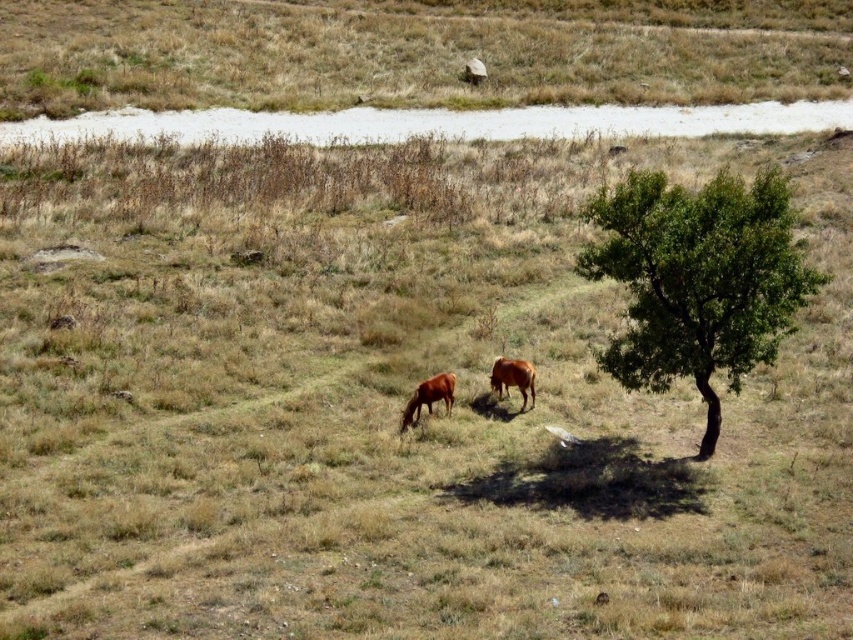
Is green leafy tree at right thinner than brown glossy cow at center?

Yes, green leafy tree at right is thinner than brown glossy cow at center.

In the scene shown: Who is positioned more to the left, green leafy tree at right or brown glossy cow at center?

Positioned to the left is brown glossy cow at center.

Who is more forward, (718, 269) or (508, 372)?

Point (718, 269) is in front.

Where is `green leafy tree at right`? green leafy tree at right is located at coordinates (698, 280).

Which is more to the right, brown matte cow at center or brown glossy cow at center?

brown glossy cow at center is more to the right.

Can you confirm if brown matte cow at center is positioned above brown glossy cow at center?

Actually, brown matte cow at center is below brown glossy cow at center.

Who is more forward, (453,387) or (502,397)?

Point (453,387)

Locate an element on the screen. brown matte cow at center is located at coordinates (428, 397).

Who is more forward, (724,176) or (445,392)?

Point (445,392)

Is point (791, 243) more distant than point (431, 404)?

That is False.

Which is behind, point (613, 237) or point (440, 387)?

The point (440, 387) is more distant.

This screenshot has width=853, height=640. In order to click on green leafy tree at right in this screenshot , I will do `click(698, 280)`.